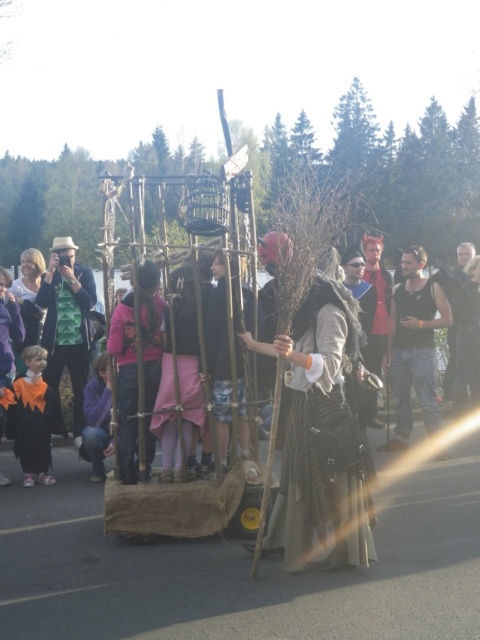
Between pink fabric at center and pink fabric dress at center, which one is positioned lower?

pink fabric dress at center

Is pink fabric at center bigger than pink fabric dress at center?

Indeed, pink fabric at center has a larger size compared to pink fabric dress at center.

This screenshot has height=640, width=480. I want to click on pink fabric at center, so [x=126, y=384].

At what (x,y) coordinates should I click in order to perform the action: click on pink fabric at center. Please return your answer as a coordinate pair (x, y). The height and width of the screenshot is (640, 480). Looking at the image, I should click on (126, 384).

Measure the distance between point (48, 365) and camera.

A distance of 25.12 feet exists between point (48, 365) and camera.

Is point (73, 419) less distant than point (469, 291)?

Yes, point (73, 419) is in front of point (469, 291).

Does point (67, 326) come in front of point (478, 355)?

Yes, it is in front of point (478, 355).

Locate an element on the screen. The width and height of the screenshot is (480, 640). green textured shirt at left is located at coordinates (67, 323).

Does brown textured fabric dress at center appear on the right side of purple fleece jacket at lower left?

A: Yes, brown textured fabric dress at center is to the right of purple fleece jacket at lower left.

Identify the location of brown textured fabric dress at center. (312, 442).

Where is `brown textured fabric dress at center`? The width and height of the screenshot is (480, 640). brown textured fabric dress at center is located at coordinates (312, 442).